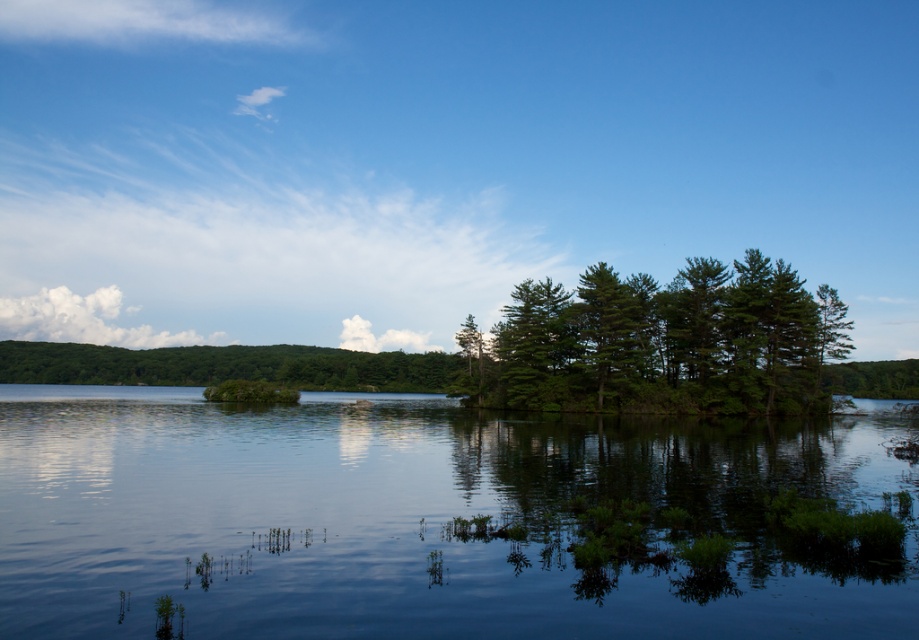
You are an environmental scientist observing the landscape. You notice two green matte trees at center and a green matte tree at center. Which one has a smaller size?

The green matte trees at center has a smaller size compared to the green matte tree at center.